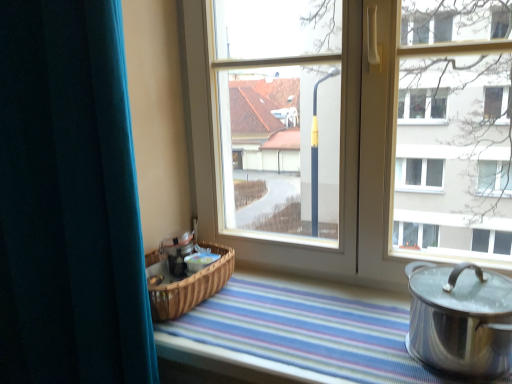
Find the location of a particular element. The width and height of the screenshot is (512, 384). free space that is to the left of polished silver pot at lower right is located at coordinates point(353,346).